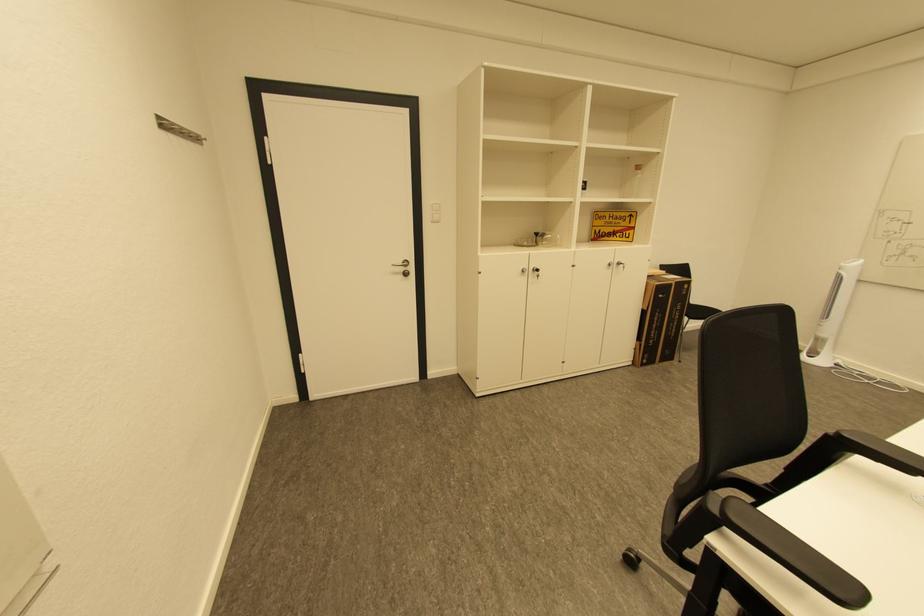
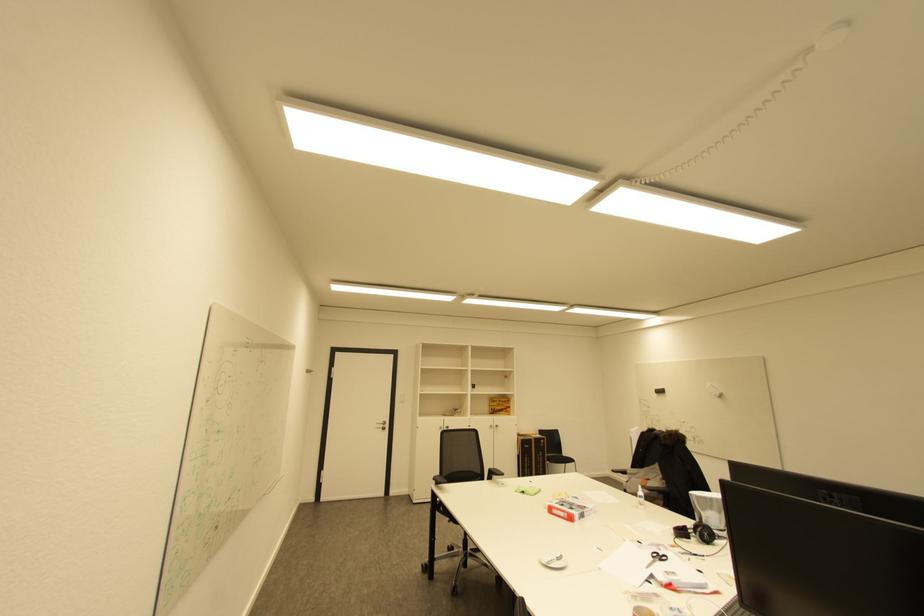
Locate, in the second image, the point that corresponds to (x=403, y=274) in the first image.

(385, 429)